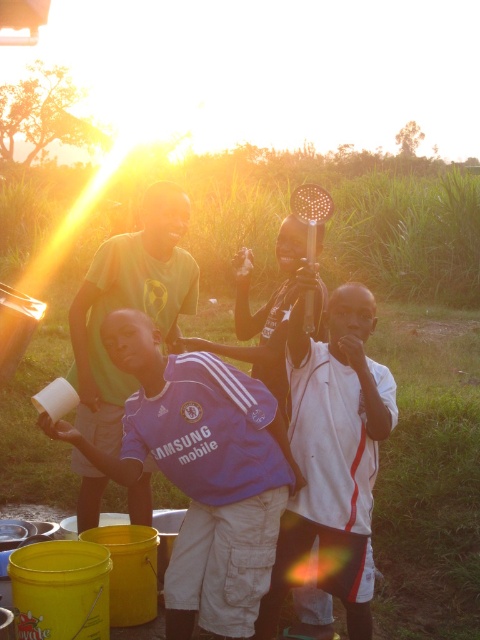
Question: Which point is farther to the camera?

Choices:
 (A) (320, 483)
 (B) (226, 412)

Answer: (A)

Question: Does purple jersey at center have a larger size compared to white jersey at center?

Choices:
 (A) yes
 (B) no

Answer: (A)

Question: Can you confirm if white jersey at center is thinner than black plastic comb at center?

Choices:
 (A) no
 (B) yes

Answer: (B)

Question: Is purple jersey at center closer to the viewer compared to black plastic comb at center?

Choices:
 (A) no
 (B) yes

Answer: (B)

Question: Which of the following is the farthest from the observer?

Choices:
 (A) (265, 321)
 (B) (332, 476)

Answer: (A)

Question: Considering the real-world distances, which object is farthest from the purple jersey at center?

Choices:
 (A) black plastic comb at center
 (B) green matte shirt at center

Answer: (B)